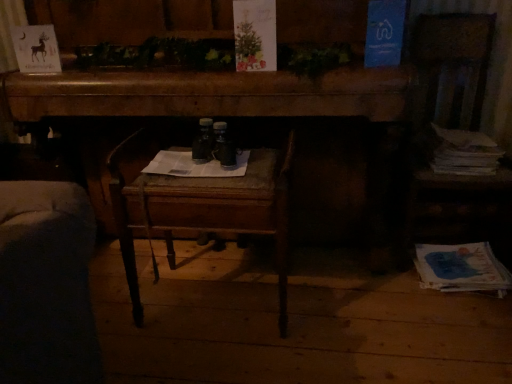
Where is `wooden chair at center`? This screenshot has height=384, width=512. wooden chair at center is located at coordinates (200, 206).

At what (x,y) coordinates should I click in order to perform the action: click on wooden desk at center. Please return your answer as a coordinate pair (x, y). Looking at the image, I should click on (208, 94).

The width and height of the screenshot is (512, 384). In order to click on wooden chair at center in this screenshot , I will do `click(200, 206)`.

You are a GUI agent. You are given a task and a screenshot of the screen. Output one action in this format:
    pyautogui.click(x=<x>, y=<y>)
    Task: Click on the desk in front of the blue paper at lower right, the 2th magazine from the top
    The height and width of the screenshot is (384, 512).
    Given the screenshot: What is the action you would take?
    pyautogui.click(x=208, y=94)

Considering the points (437, 262) and (262, 81), which point is in front, point (437, 262) or point (262, 81)?

Point (262, 81)

Considering the sizes of blue paper at lower right, the 1th magazine positioned from the bottom, and wooden desk at center in the image, is blue paper at lower right, the 1th magazine positioned from the bottom, wider or thinner than wooden desk at center?

Clearly, blue paper at lower right, the 1th magazine positioned from the bottom, has less width compared to wooden desk at center.

Is blue paper at lower right, the 2th magazine from the top, in front of wooden desk at center?

That is False.

Is white paper stack at right, the first magazine viewed from the top, turned away from blue paper at lower right, the 2th magazine from the top?

white paper stack at right, the first magazine viewed from the top, does not have its back to blue paper at lower right, the 2th magazine from the top.

Between white paper stack at right, the first magazine viewed from the top, and blue paper at lower right, the 2th magazine from the top, which one appears on the left side from the viewer's perspective?

From the viewer's perspective, blue paper at lower right, the 2th magazine from the top, appears more on the left side.

Between white paper stack at right, positioned as the 2th magazine in bottom-to-top order, and blue paper at lower right, the 1th magazine positioned from the bottom, which one has less height?

blue paper at lower right, the 1th magazine positioned from the bottom.

Considering the positions of points (453, 161) and (481, 280), is point (453, 161) farther from camera compared to point (481, 280)?

Yes.

Is white paper stack at right, positioned as the 2th magazine in bottom-to-top order, facing towards wooden desk at center?

No, white paper stack at right, positioned as the 2th magazine in bottom-to-top order, is not facing towards wooden desk at center.

Does white paper stack at right, the first magazine viewed from the top, come behind wooden desk at center?

Yes, it is.

Would you consider white paper stack at right, positioned as the 2th magazine in bottom-to-top order, to be distant from wooden desk at center?

They are positioned close to each other.

Considering the sizes of objects white paper stack at right, the first magazine viewed from the top, and wooden desk at center in the image provided, who is smaller, white paper stack at right, the first magazine viewed from the top, or wooden desk at center?

white paper stack at right, the first magazine viewed from the top.

Is point (447, 286) closer to camera compared to point (121, 224)?

That is False.

Is wooden chair at center surrounded by blue paper at lower right, the 1th magazine positioned from the bottom?

That's incorrect, wooden chair at center is not inside blue paper at lower right, the 1th magazine positioned from the bottom.

Considering the relative sizes of blue paper at lower right, the 2th magazine from the top, and wooden chair at center in the image provided, is blue paper at lower right, the 2th magazine from the top, bigger than wooden chair at center?

Actually, blue paper at lower right, the 2th magazine from the top, might be smaller than wooden chair at center.

Who is shorter, blue paper at lower right, the 2th magazine from the top, or wooden chair at center?

blue paper at lower right, the 2th magazine from the top.

Would you say wooden chair at center is a long distance from wooden desk at center?

No, wooden chair at center is in close proximity to wooden desk at center.

Is wooden chair at center in front of or behind wooden desk at center in the image?

Clearly, wooden chair at center is in front of wooden desk at center.

Is point (164, 221) closer to viewer compared to point (343, 83)?

Yes, it is.

Consider the image. From the image's perspective, between wooden chair at center and wooden desk at center, which one is located above?

From the image's view, wooden desk at center is above.

From the image's perspective, is wooden chair at center on top of white paper stack at right, the first magazine viewed from the top?

Actually, wooden chair at center appears below white paper stack at right, the first magazine viewed from the top, in the image.

Is wooden chair at center wider than white paper stack at right, the first magazine viewed from the top?

Yes.

Is wooden chair at center taller than white paper stack at right, the first magazine viewed from the top?

Indeed, wooden chair at center has a greater height compared to white paper stack at right, the first magazine viewed from the top.

Measure the distance between blue paper at lower right, the 1th magazine positioned from the bottom, and white paper stack at right, the first magazine viewed from the top.

14.47 inches.

How different are the orientations of blue paper at lower right, the 1th magazine positioned from the bottom, and white paper stack at right, positioned as the 2th magazine in bottom-to-top order, in degrees?

They differ by 9.15e-05 degrees in their facing directions.

Consider the image. Can you confirm if blue paper at lower right, the 1th magazine positioned from the bottom, is positioned to the right of white paper stack at right, positioned as the 2th magazine in bottom-to-top order?

No, blue paper at lower right, the 1th magazine positioned from the bottom, is not to the right of white paper stack at right, positioned as the 2th magazine in bottom-to-top order.

Where is `magazine lying above the blue paper at lower right, the 2th magazine from the top (from the image's perspective)`? This screenshot has height=384, width=512. magazine lying above the blue paper at lower right, the 2th magazine from the top (from the image's perspective) is located at coordinates (463, 152).

Where is `desk that is in front of the blue paper at lower right, the 2th magazine from the top`? desk that is in front of the blue paper at lower right, the 2th magazine from the top is located at coordinates (208, 94).

Where is `magazine below the white paper stack at right, the first magazine viewed from the top (from a real-world perspective)`? magazine below the white paper stack at right, the first magazine viewed from the top (from a real-world perspective) is located at coordinates (461, 268).

Which object lies further to the anchor point wooden desk at center, blue paper at lower right, the 1th magazine positioned from the bottom, or white paper stack at right, positioned as the 2th magazine in bottom-to-top order?

blue paper at lower right, the 1th magazine positioned from the bottom, is further to wooden desk at center.

Considering their positions, is wooden chair at center positioned closer to blue paper at lower right, the 2th magazine from the top, than wooden desk at center?

wooden desk at center.

Based on their spatial positions, is wooden chair at center or wooden desk at center closer to white paper stack at right, positioned as the 2th magazine in bottom-to-top order?

wooden desk at center.

Considering their positions, is wooden chair at center positioned further to blue paper at lower right, the 1th magazine positioned from the bottom, than white paper stack at right, positioned as the 2th magazine in bottom-to-top order?

The object further to blue paper at lower right, the 1th magazine positioned from the bottom, is wooden chair at center.

Looking at the image, which one is located closer to wooden desk at center, white paper stack at right, the first magazine viewed from the top, or wooden chair at center?

Among the two, wooden chair at center is located nearer to wooden desk at center.

From the image, which object appears to be nearer to wooden chair at center, wooden desk at center or white paper stack at right, positioned as the 2th magazine in bottom-to-top order?

wooden desk at center.

From the image, which object appears to be farther from wooden chair at center, blue paper at lower right, the 1th magazine positioned from the bottom, or wooden desk at center?

blue paper at lower right, the 1th magazine positioned from the bottom, is further to wooden chair at center.

Based on their spatial positions, is white paper stack at right, positioned as the 2th magazine in bottom-to-top order, or wooden desk at center further from blue paper at lower right, the 2th magazine from the top?

wooden desk at center is further to blue paper at lower right, the 2th magazine from the top.

You are a GUI agent. You are given a task and a screenshot of the screen. Output one action in this format:
    pyautogui.click(x=<x>, y=<y>)
    Task: Click on the chair between wooden desk at center and white paper stack at right, the first magazine viewed from the top
    
    Given the screenshot: What is the action you would take?
    coord(200,206)

In order to click on magazine situated between wooden chair at center and white paper stack at right, the first magazine viewed from the top, from left to right in this screenshot , I will do `click(461, 268)`.

Identify the location of chair between wooden desk at center and blue paper at lower right, the 1th magazine positioned from the bottom, in the horizontal direction. (200, 206).

At what (x,y) coordinates should I click in order to perform the action: click on magazine between wooden desk at center and white paper stack at right, positioned as the 2th magazine in bottom-to-top order. Please return your answer as a coordinate pair (x, y). The image size is (512, 384). Looking at the image, I should click on (461, 268).